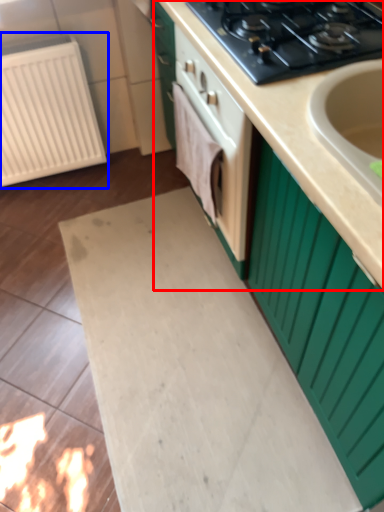
Question: Which point is closer to the camera, countertop (highlighted by a red box) or radiator (highlighted by a blue box)?

Choices:
 (A) countertop
 (B) radiator

Answer: (A)